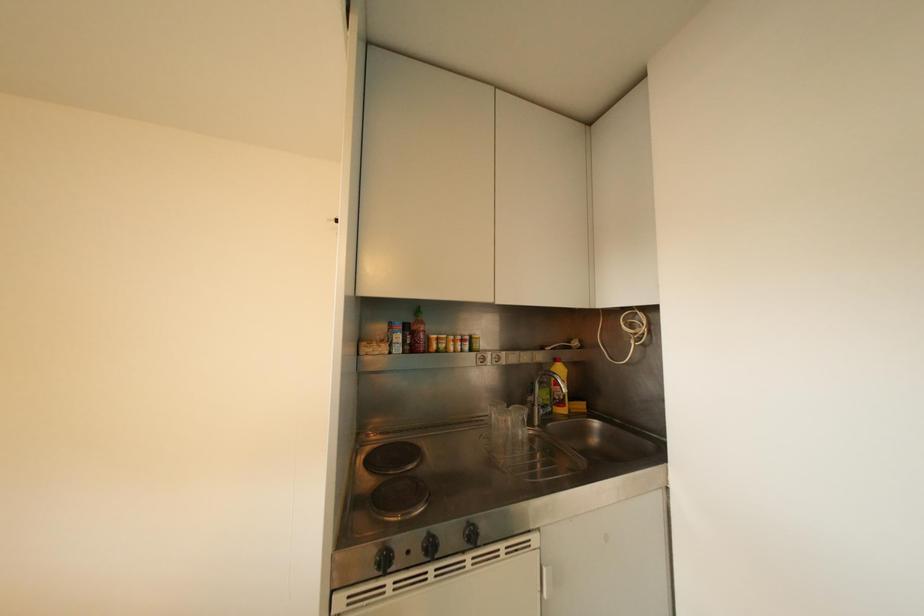
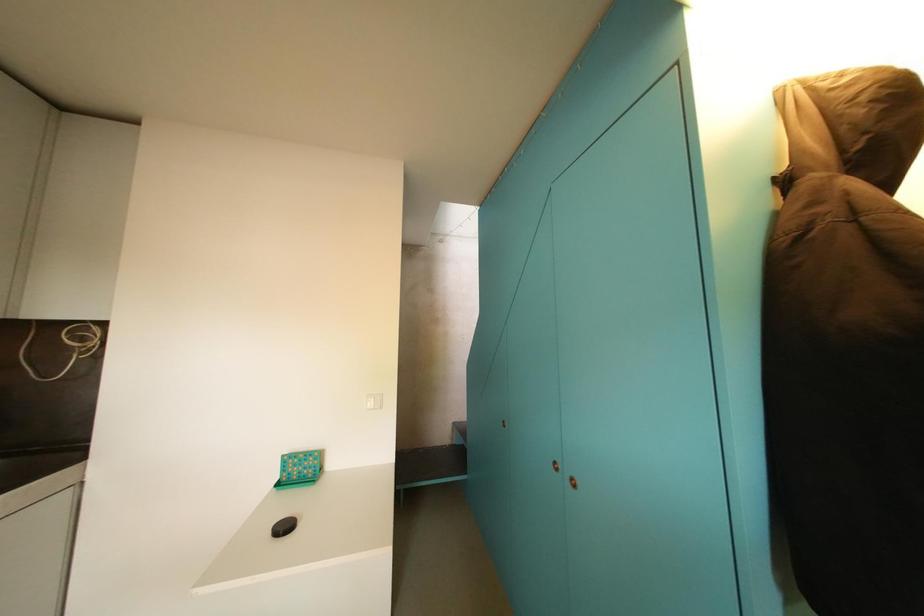
Question: The images are taken continuously from a first-person perspective. In which direction is your viewpoint rotating?

Choices:
 (A) Left
 (B) Right
 (C) Up
 (D) Down

Answer: (B)